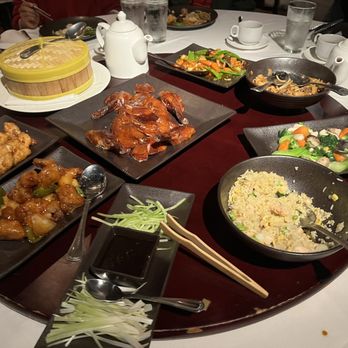
Locate an element on the screen. jug is located at coordinates (129, 54).